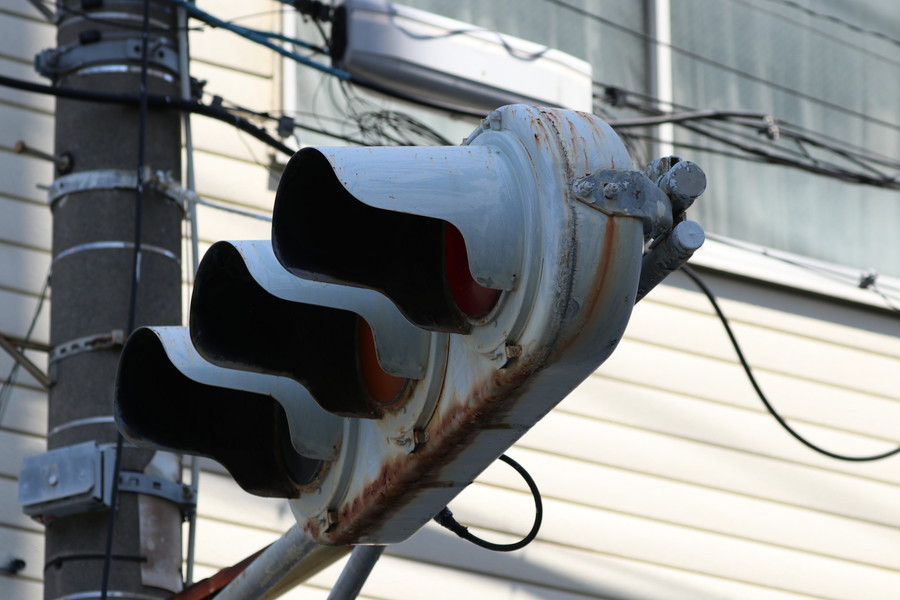
This screenshot has width=900, height=600. Identify the location of window. (778, 182).